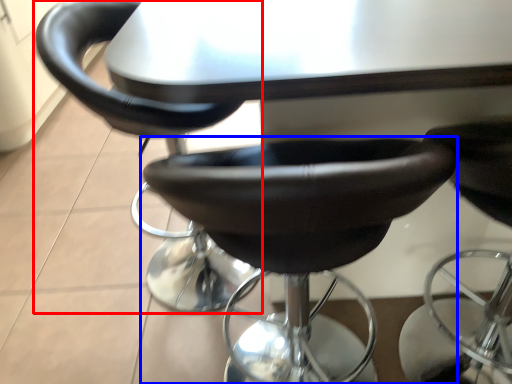
Question: Which object appears farthest to the camera in this image, chair (highlighted by a red box) or chair (highlighted by a blue box)?

Choices:
 (A) chair
 (B) chair

Answer: (A)